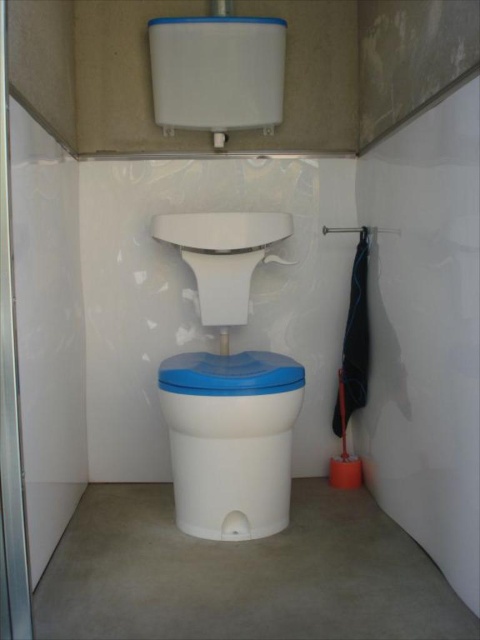
Question: Observing the image, what is the correct spatial positioning of white plastic toilet bowl at center in reference to transparent glass screen door at left?

Choices:
 (A) below
 (B) above

Answer: (A)

Question: Does white plastic toilet bowl at center have a larger size compared to transparent glass screen door at left?

Choices:
 (A) yes
 (B) no

Answer: (A)

Question: Is the position of white plastic toilet bowl at center more distant than that of transparent glass screen door at left?

Choices:
 (A) yes
 (B) no

Answer: (A)

Question: Which point is closer to the camera taking this photo?

Choices:
 (A) (215, 419)
 (B) (9, 163)

Answer: (B)